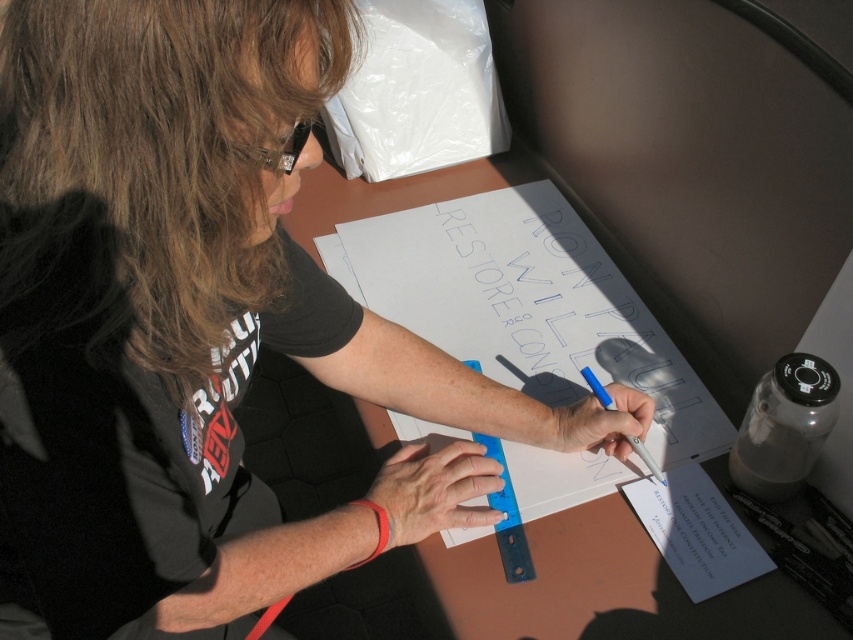
Consider the image. Is brown wood table at center to the left of blue plastic pen at center from the viewer's perspective?

Yes, brown wood table at center is to the left of blue plastic pen at center.

Which is above, brown wood table at center or blue plastic pen at center?

Positioned higher is brown wood table at center.

Is point (579, 513) closer to viewer compared to point (602, 396)?

Yes, point (579, 513) is closer to viewer.

Where is `brown wood table at center`? This screenshot has width=853, height=640. brown wood table at center is located at coordinates (602, 588).

Does point (746, 538) lie behind point (630, 440)?

No, (746, 538) is in front of (630, 440).

How distant is white paper at center from blue plastic pen at center?

white paper at center and blue plastic pen at center are 2.97 inches apart from each other.

The height and width of the screenshot is (640, 853). I want to click on white paper at center, so click(x=700, y=538).

This screenshot has width=853, height=640. What do you see at coordinates (602, 588) in the screenshot? I see `brown wood table at center` at bounding box center [602, 588].

How distant is brown wood table at center from white paper at center?

brown wood table at center is 8.13 inches away from white paper at center.

I want to click on brown wood table at center, so click(x=602, y=588).